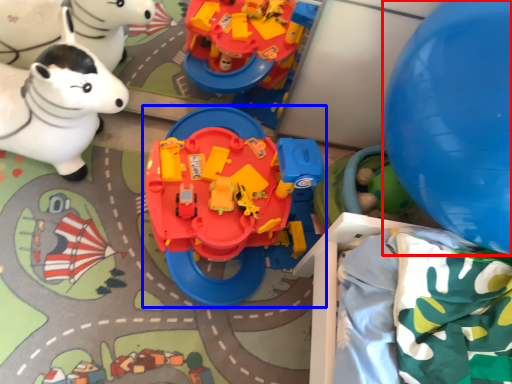
Question: Which object appears closest to the camera in this image, balloon (highlighted by a red box) or toy (highlighted by a blue box)?

Choices:
 (A) balloon
 (B) toy

Answer: (A)